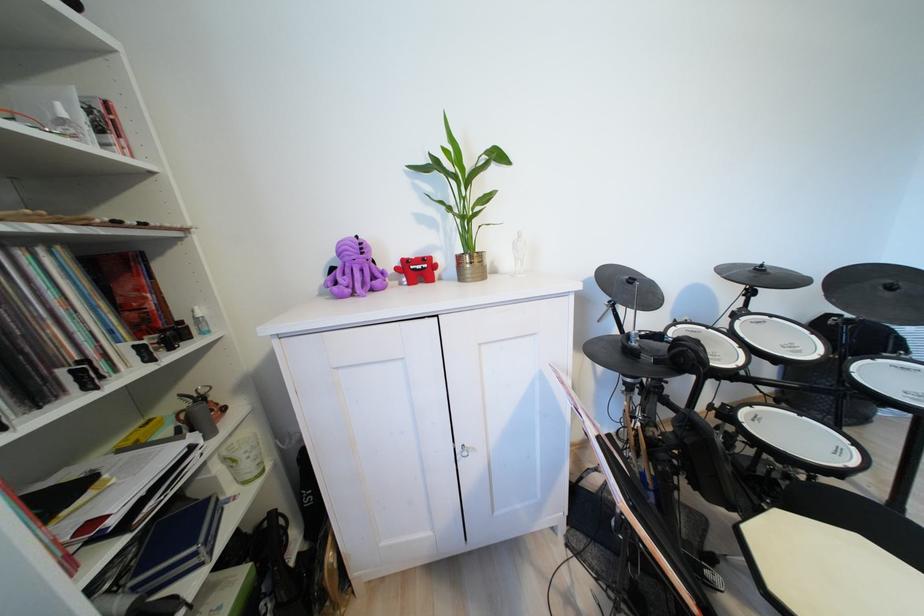
Find the location of a particular element. The image size is (924, 616). red monster toy is located at coordinates (417, 269).